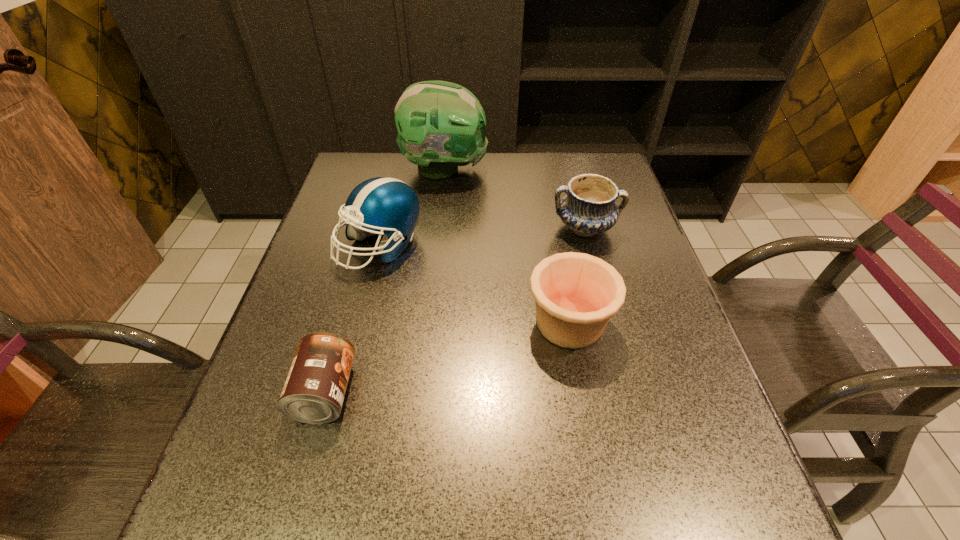
Locate an element on the screen. The width and height of the screenshot is (960, 540). free point between the farther football helmet and the farther pottery is located at coordinates (515, 198).

Where is `free space between the farther pottery and the farther football helmet`? free space between the farther pottery and the farther football helmet is located at coordinates (515, 198).

Where is `unoccupied position between the nearer pottery and the farther football helmet`? The height and width of the screenshot is (540, 960). unoccupied position between the nearer pottery and the farther football helmet is located at coordinates (507, 246).

Locate an element on the screen. Image resolution: width=960 pixels, height=540 pixels. vacant area between the nearer football helmet and the shortest object is located at coordinates (352, 319).

Where is `free space between the farther pottery and the nearer football helmet`? The image size is (960, 540). free space between the farther pottery and the nearer football helmet is located at coordinates (482, 237).

This screenshot has height=540, width=960. I want to click on vacant space that's between the shortest object and the farther football helmet, so click(x=385, y=281).

The width and height of the screenshot is (960, 540). Find the location of `free space between the farther pottery and the shortest object`. free space between the farther pottery and the shortest object is located at coordinates pos(455,310).

Identify the location of empty space between the fourth shortest object and the farther pottery. The image size is (960, 540). (482, 237).

You are a GUI agent. You are given a task and a screenshot of the screen. Output one action in this format:
    pyautogui.click(x=<x>, y=<y>)
    Task: Click on the object that is the second nearest to the farther pottery
    The height and width of the screenshot is (540, 960).
    Given the screenshot: What is the action you would take?
    pyautogui.click(x=441, y=125)

Find the location of `object that stands as the fourth closest to the can`. object that stands as the fourth closest to the can is located at coordinates (441, 125).